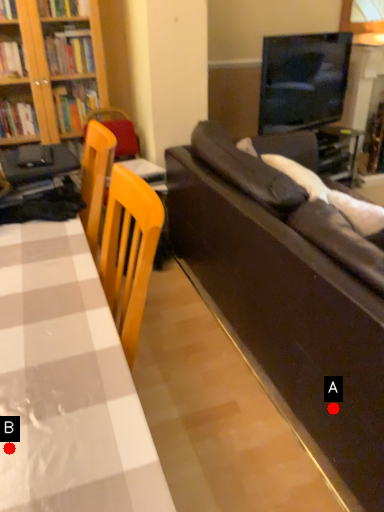
Question: Two points are circled on the image, labeled by A and B beside each circle. Which point appears farthest from the camera in this image?

Choices:
 (A) A is further
 (B) B is further

Answer: (A)